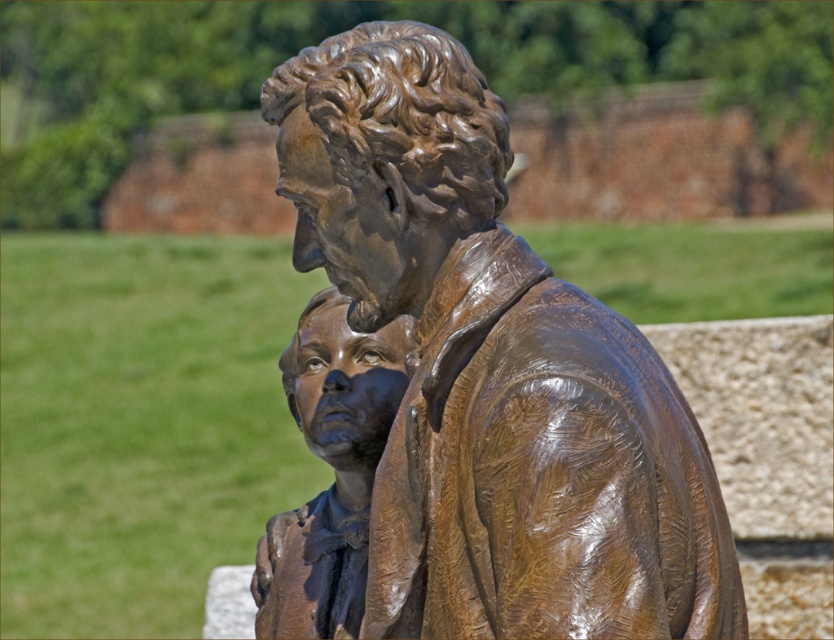
Consider the image. You are a tour guide explaining the layout of the sculpture garden. Where is the shiny bronze statue at center located in terms of coordinates?

The shiny bronze statue at center is located at coordinates point (x=491, y=371).